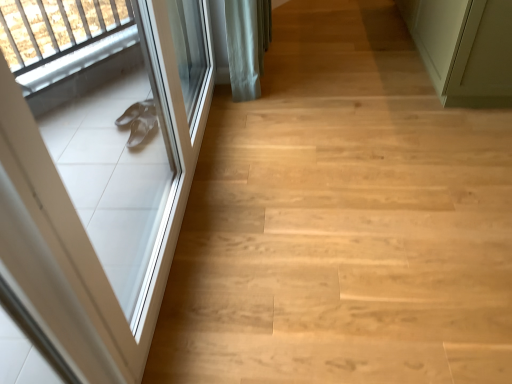
Question: Considering the relative sizes of light wood floor at left and white glossy door at left, marked as the 1th door in a left-to-right arrangement, in the image provided, is light wood floor at left smaller than white glossy door at left, marked as the 1th door in a left-to-right arrangement,?

Choices:
 (A) no
 (B) yes

Answer: (A)

Question: Is the position of light wood floor at left more distant than that of white glossy door at left, marked as the 1th door in a left-to-right arrangement?

Choices:
 (A) yes
 (B) no

Answer: (A)

Question: From the image's perspective, is light wood floor at left below white glossy door at left, marked as the 1th door in a left-to-right arrangement?

Choices:
 (A) yes
 (B) no

Answer: (B)

Question: Does light wood floor at left appear on the right side of white glossy door at left, which ranks as the 2th door in right-to-left order?

Choices:
 (A) no
 (B) yes

Answer: (B)

Question: Can you confirm if light wood floor at left is thinner than white glossy door at left, marked as the 1th door in a left-to-right arrangement?

Choices:
 (A) yes
 (B) no

Answer: (B)

Question: Would you say light wood floor at left is to the left or to the right of green matte door at upper right, which is the second door from left to right, in the picture?

Choices:
 (A) right
 (B) left

Answer: (B)

Question: In the image, is light wood floor at left positioned in front of or behind green matte door at upper right, which is the second door from left to right?

Choices:
 (A) front
 (B) behind

Answer: (A)

Question: From their relative heights in the image, would you say light wood floor at left is taller or shorter than green matte door at upper right, which is the second door from left to right?

Choices:
 (A) tall
 (B) short

Answer: (B)

Question: Is light wood floor at left spatially inside green matte door at upper right, the 1th door when ordered from right to left, or outside of it?

Choices:
 (A) inside
 (B) outside

Answer: (B)

Question: From a real-world perspective, relative to white glossy door at left, marked as the 1th door in a left-to-right arrangement, is light wood floor at left vertically above or below?

Choices:
 (A) below
 (B) above

Answer: (A)

Question: Considering their positions, is light wood floor at left located in front of or behind white glossy door at left, marked as the 1th door in a left-to-right arrangement?

Choices:
 (A) behind
 (B) front

Answer: (A)

Question: From the image's perspective, is light wood floor at left above or below white glossy door at left, which ranks as the 2th door in right-to-left order?

Choices:
 (A) below
 (B) above

Answer: (B)

Question: In terms of height, does light wood floor at left look taller or shorter compared to white glossy door at left, which ranks as the 2th door in right-to-left order?

Choices:
 (A) tall
 (B) short

Answer: (B)

Question: In the image, is white glossy door at left, marked as the 1th door in a left-to-right arrangement, on the left side or the right side of light wood floor at left?

Choices:
 (A) left
 (B) right

Answer: (A)

Question: Is white glossy door at left, marked as the 1th door in a left-to-right arrangement, in front of or behind light wood floor at left in the image?

Choices:
 (A) front
 (B) behind

Answer: (A)